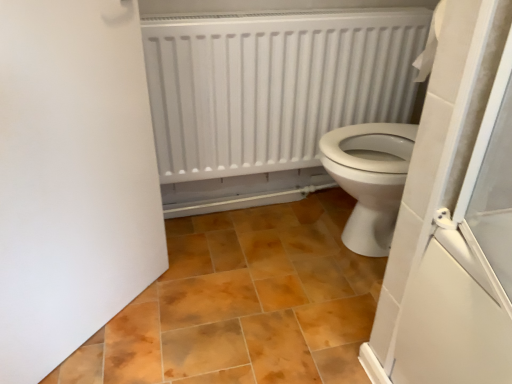
Locate an element on the screen. The width and height of the screenshot is (512, 384). white matte radiator at upper center is located at coordinates (273, 84).

Where is `brown matte tile at center`? The height and width of the screenshot is (384, 512). brown matte tile at center is located at coordinates (244, 303).

From the picture: Does white matte door at left touch white matte radiator at upper center?

white matte door at left is not next to white matte radiator at upper center, and they're not touching.

Between white matte door at left and white matte radiator at upper center, which one has more height?

Standing taller between the two is white matte door at left.

Which object is further away from the camera taking this photo, white matte door at left or white matte radiator at upper center?

Positioned behind is white matte radiator at upper center.

Considering the positions of objects white matte door at left and white matte radiator at upper center in the image provided, who is more to the left, white matte door at left or white matte radiator at upper center?

From the viewer's perspective, white matte door at left appears more on the left side.

How far apart are brown matte tile at center and white matte door at left?

brown matte tile at center and white matte door at left are 16.88 inches apart.

Is brown matte tile at center taller than white matte door at left?

No.

Could you tell me if brown matte tile at center is facing white matte door at left?

Yes, brown matte tile at center is aimed at white matte door at left.

Is brown matte tile at center directly adjacent to white matte door at left?

They are not placed beside each other.

Is brown matte tile at center oriented towards white matte radiator at upper center?

No, brown matte tile at center is not oriented towards white matte radiator at upper center.

Is point (312, 253) farther from camera compared to point (298, 13)?

Yes, point (312, 253) is behind point (298, 13).

Based on their positions, is brown matte tile at center located to the left or right of white matte radiator at upper center?

brown matte tile at center is positioned on white matte radiator at upper center's left side.

Considering the sizes of brown matte tile at center and white matte radiator at upper center in the image, is brown matte tile at center taller or shorter than white matte radiator at upper center?

Considering their sizes, brown matte tile at center has less height than white matte radiator at upper center.

Considering the points (259, 22) and (145, 209), which point is behind, point (259, 22) or point (145, 209)?

The point (259, 22) is behind.

How different are the orientations of white matte radiator at upper center and white matte door at left in degrees?

The facing directions of white matte radiator at upper center and white matte door at left are 44.3 degrees apart.

What are the coordinates of `radiator that is behind the white matte door at left` in the screenshot? It's located at (273, 84).

Which object is closer to the camera, white matte radiator at upper center or white matte door at left?

white matte door at left.

From the image's perspective, between white matte door at left and brown matte tile at center, which one is located above?

white matte door at left appears higher in the image.

Looking at this image, based on their positions, is white matte door at left located to the left or right of brown matte tile at center?

Based on their positions, white matte door at left is located to the left of brown matte tile at center.

Based on the photo, does white matte door at left have a greater width compared to brown matte tile at center?

Incorrect, the width of white matte door at left does not surpass that of brown matte tile at center.

How different are the orientations of white matte radiator at upper center and brown matte tile at center in degrees?

white matte radiator at upper center and brown matte tile at center are facing 90.7 degrees away from each other.

Can we say white matte radiator at upper center lies outside brown matte tile at center?

white matte radiator at upper center lies outside brown matte tile at center's area.

Find the location of a particular element. ceramic tile that is under the white matte radiator at upper center (from a real-world perspective) is located at coordinates (244, 303).

In the image, there is a white matte door at left. Identify the location of radiator above it (from the image's perspective). Image resolution: width=512 pixels, height=384 pixels. [x=273, y=84].

Locate an element on the screen. door positioned vertically above the brown matte tile at center (from a real-world perspective) is located at coordinates (72, 177).

Considering their positions, is white matte door at left positioned closer to brown matte tile at center than white matte radiator at upper center?

white matte door at left is positioned closer to the anchor brown matte tile at center.

Considering their positions, is brown matte tile at center positioned closer to white matte door at left than white matte radiator at upper center?

brown matte tile at center is closer to white matte door at left.

From the picture: Looking at the image, which one is located further to white matte radiator at upper center, brown matte tile at center or white matte door at left?

white matte door at left is positioned further to the anchor white matte radiator at upper center.

From the image, which object appears to be farther from white matte door at left, white matte radiator at upper center or brown matte tile at center?

The object further to white matte door at left is white matte radiator at upper center.

Based on their spatial positions, is white matte door at left or brown matte tile at center further from white matte radiator at upper center?

white matte door at left is further to white matte radiator at upper center.

Looking at the image, which one is located further to brown matte tile at center, white matte radiator at upper center or white matte door at left?

white matte radiator at upper center lies further to brown matte tile at center than the other object.

You are a GUI agent. You are given a task and a screenshot of the screen. Output one action in this format:
    pyautogui.click(x=<x>, y=<y>)
    Task: Click on the ceramic tile positioned between white matte door at left and white matte radiator at upper center from near to far
    This screenshot has height=384, width=512.
    Given the screenshot: What is the action you would take?
    pyautogui.click(x=244, y=303)